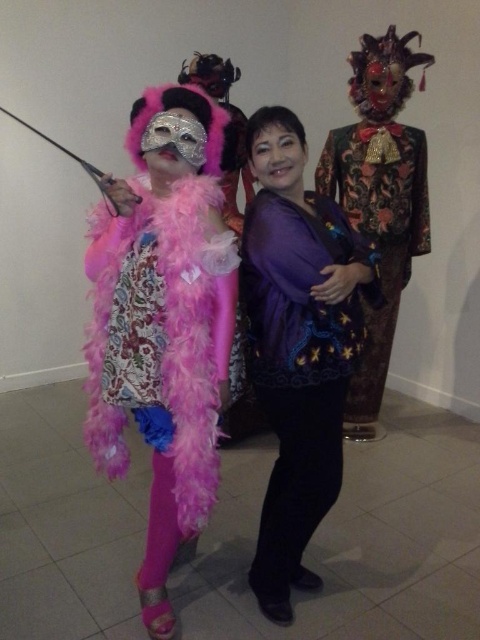
Question: Can you confirm if fuzzy pink boa at center is smaller than velvet brocade robe at right?

Choices:
 (A) yes
 (B) no

Answer: (A)

Question: Which of the following is the farthest from the observer?

Choices:
 (A) (296, 173)
 (B) (396, 224)

Answer: (B)

Question: Which of the following is the farthest from the observer?

Choices:
 (A) fuzzy pink boa at center
 (B) velvet brocade robe at right

Answer: (B)

Question: Which point appears farthest from the camera in this image?

Choices:
 (A) (301, 230)
 (B) (376, 120)

Answer: (B)

Question: Can you confirm if fuzzy pink boa at center is smaller than velvet brocade robe at right?

Choices:
 (A) no
 (B) yes

Answer: (B)

Question: Is purple satin blouse at center bigger than velvet brocade robe at right?

Choices:
 (A) yes
 (B) no

Answer: (B)